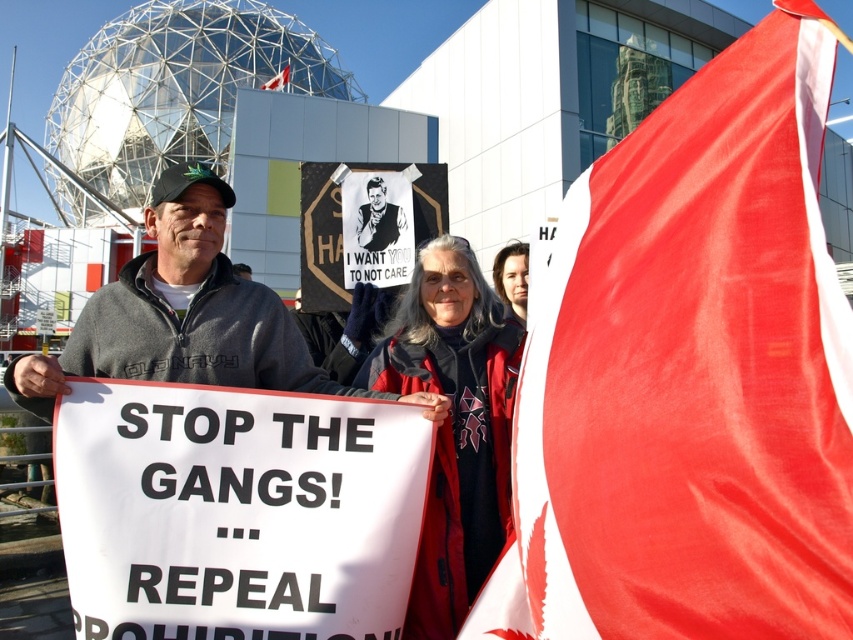
You are a photographer taking a picture of the protest scene. You want to ensure the matte black jacket at center is centered in your photo. What coordinates should you aim for?

The matte black jacket at center is located at coordinates (512, 278), so you should aim for those coordinates to center it in your photo.

You are a photographer standing at the center of the protest scene. You want to take a photo that includes both the matte black jacket at center and the red fabric flag at upper right. Given that your camera has a maximum zoom range of 500 feet, will you be able to capture both objects in the same frame without moving your position?

The distance between the matte black jacket at center and the red fabric flag at upper right is 391.75 feet, which is within the camera maximum zoom range of 500 feet. Therefore, you can capture both objects in the same frame without moving.